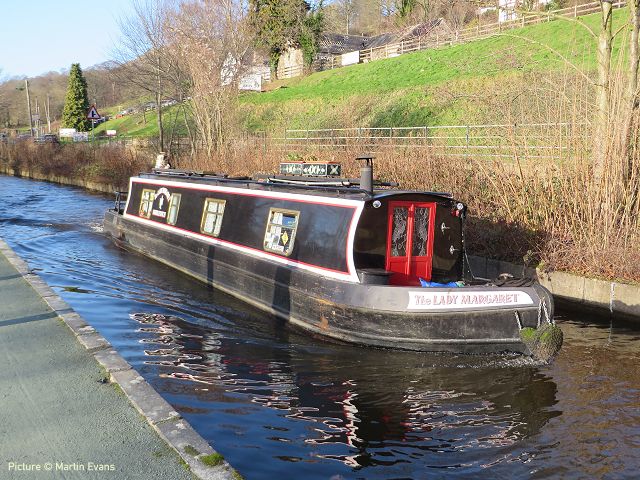
Image resolution: width=640 pixels, height=480 pixels. Find the location of `door`. door is located at coordinates (402, 231).